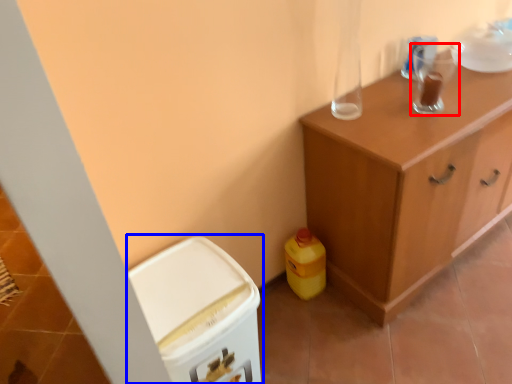
Question: Which object is further to the camera taking this photo, appliance (highlighted by a red box) or cabinetry (highlighted by a blue box)?

Choices:
 (A) appliance
 (B) cabinetry

Answer: (A)